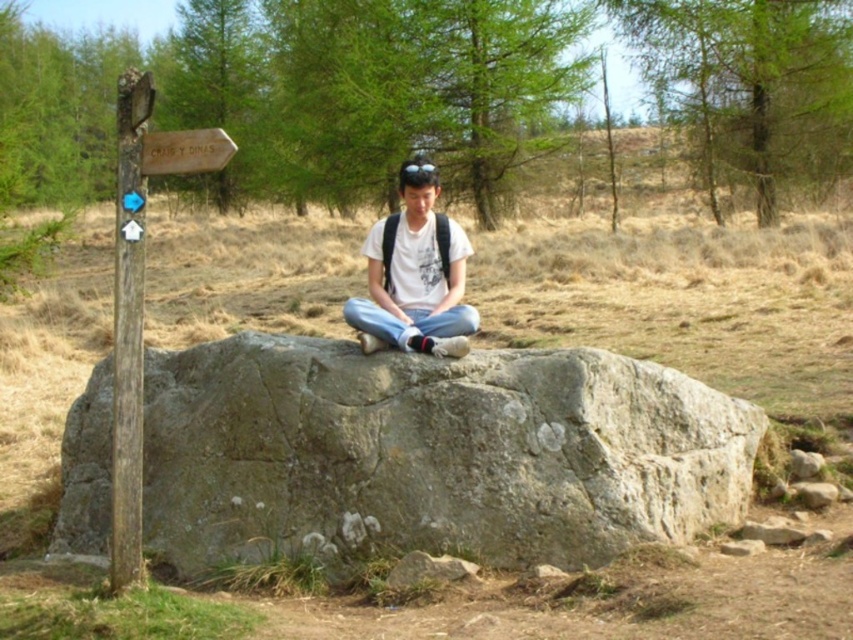
Locate an element on the screen. The image size is (853, 640). gray rough boulder at center is located at coordinates tap(431, 452).

Based on the photo, between gray rough boulder at center and white matte t-shirt at center, which one is positioned higher?

Positioned higher is white matte t-shirt at center.

Which is in front, point (149, 394) or point (450, 262)?

Point (450, 262)

Find the location of a particular element. This screenshot has height=640, width=853. gray rough boulder at center is located at coordinates (431, 452).

Can you confirm if gray rough boulder at center is bigger than wooden post at left?

Yes, gray rough boulder at center is bigger than wooden post at left.

Is gray rough boulder at center shorter than wooden post at left?

Indeed, gray rough boulder at center has a lesser height compared to wooden post at left.

Identify the location of gray rough boulder at center. (431, 452).

Does white matte t-shirt at center have a lesser height compared to wooden post at left?

Correct, white matte t-shirt at center is not as tall as wooden post at left.

From the picture: Can you confirm if white matte t-shirt at center is smaller than wooden post at left?

No, white matte t-shirt at center is not smaller than wooden post at left.

Image resolution: width=853 pixels, height=640 pixels. In order to click on white matte t-shirt at center in this screenshot , I will do `click(415, 275)`.